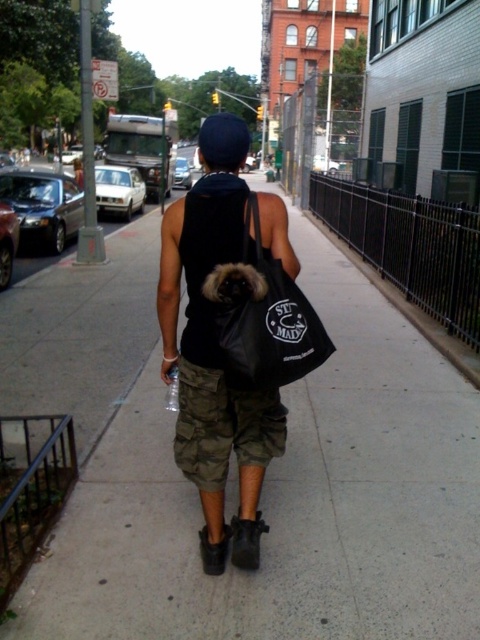
Question: Among these objects, which one is nearest to the camera?

Choices:
 (A) black matte bag at center
 (B) black canvas tote at center

Answer: (B)

Question: Which object appears farthest from the camera in this image?

Choices:
 (A) black matte bag at center
 (B) black canvas tote at center
 (C) matte concrete sidewalk at center

Answer: (A)

Question: Considering the relative positions of matte concrete sidewalk at center and black canvas tote at center in the image provided, where is matte concrete sidewalk at center located with respect to black canvas tote at center?

Choices:
 (A) below
 (B) above

Answer: (A)

Question: Can you confirm if black matte bag at center is positioned to the left of black canvas tote at center?

Choices:
 (A) no
 (B) yes

Answer: (B)

Question: Which object is the farthest from the black canvas tote at center?

Choices:
 (A) black matte bag at center
 (B) matte concrete sidewalk at center

Answer: (B)

Question: Is black matte bag at center behind black canvas tote at center?

Choices:
 (A) yes
 (B) no

Answer: (A)